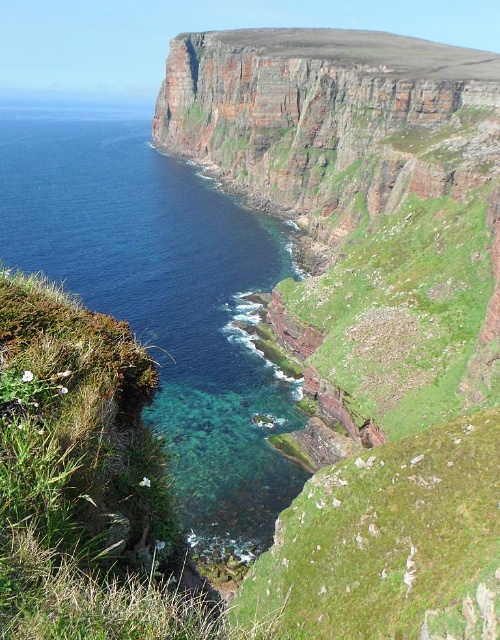
You are standing at the base of the cliffs in the coastal landscape. You notice two points marked on the cliff face. The first point is at coordinates point (296, 144), and the second is at point (274, 230). From your vantage point, which point appears closer to you?

Point (274, 230) appears closer because it is in front of point (296, 144).

You are a hiker standing at the base of the cliffs looking up at the coastal landscape. You notice a green grassy hillside at upper center. Where exactly is this hillside located in terms of coordinates?

The green grassy hillside at upper center is located at coordinates point [370,314].